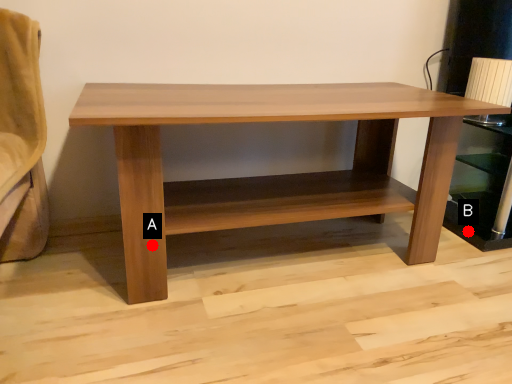
Question: Two points are circled on the image, labeled by A and B beside each circle. Which point is further to the camera?

Choices:
 (A) A is further
 (B) B is further

Answer: (B)